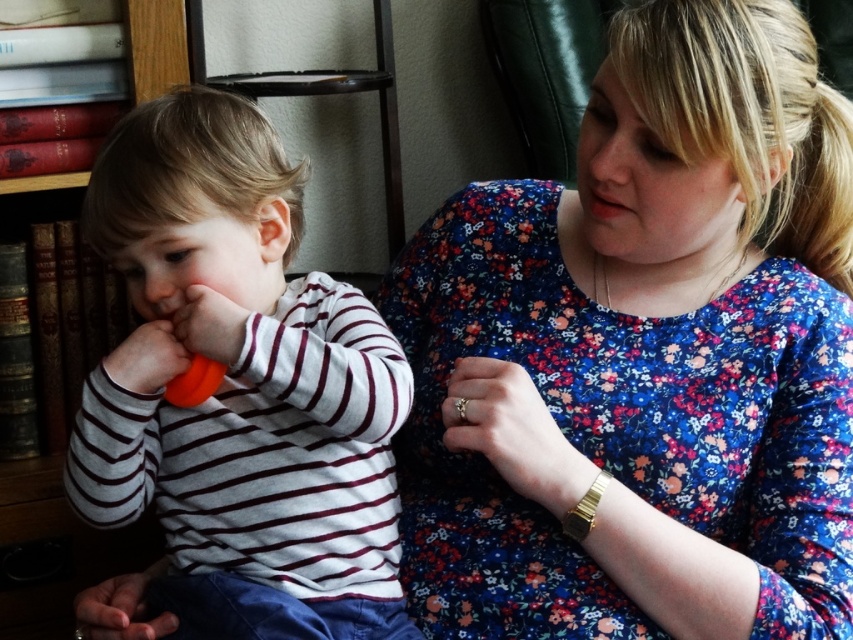
What do you see at coordinates (643, 355) in the screenshot? This screenshot has height=640, width=853. I see `blue floral dress at center` at bounding box center [643, 355].

Who is taller, blue floral dress at center or orange rubber teether at left?

Standing taller between the two is blue floral dress at center.

What are the coordinates of `blue floral dress at center` in the screenshot? It's located at (643, 355).

Is point (418, 253) closer to camera compared to point (25, 497)?

Yes.

Does blue floral dress at center lie in front of red leather bookshelf at left?

Yes, it is in front of red leather bookshelf at left.

This screenshot has width=853, height=640. I want to click on blue floral dress at center, so click(x=643, y=355).

Between orange rubber teether at left and red leather bookshelf at left, which one is positioned lower?

red leather bookshelf at left

Does point (347, 568) come in front of point (119, 547)?

Yes, it is in front of point (119, 547).

This screenshot has height=640, width=853. Find the location of `orange rubber teether at left`. orange rubber teether at left is located at coordinates (239, 388).